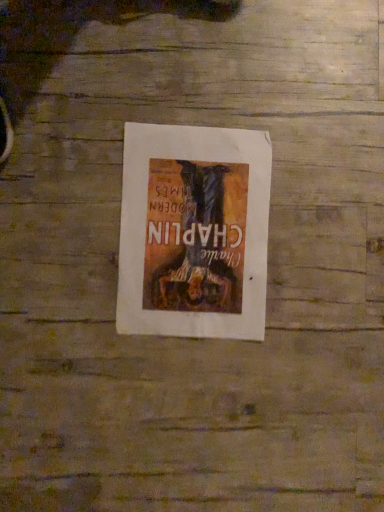
Question: Should I look upward or downward to see matte paper poster at center?

Choices:
 (A) up
 (B) down

Answer: (A)